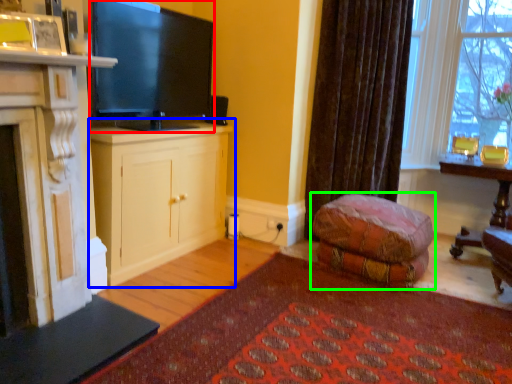
Question: Considering the real-world distances, which object is closest to television (highlighted by a red box)? cabinetry (highlighted by a blue box) or studio couch (highlighted by a green box).

Choices:
 (A) cabinetry
 (B) studio couch

Answer: (A)